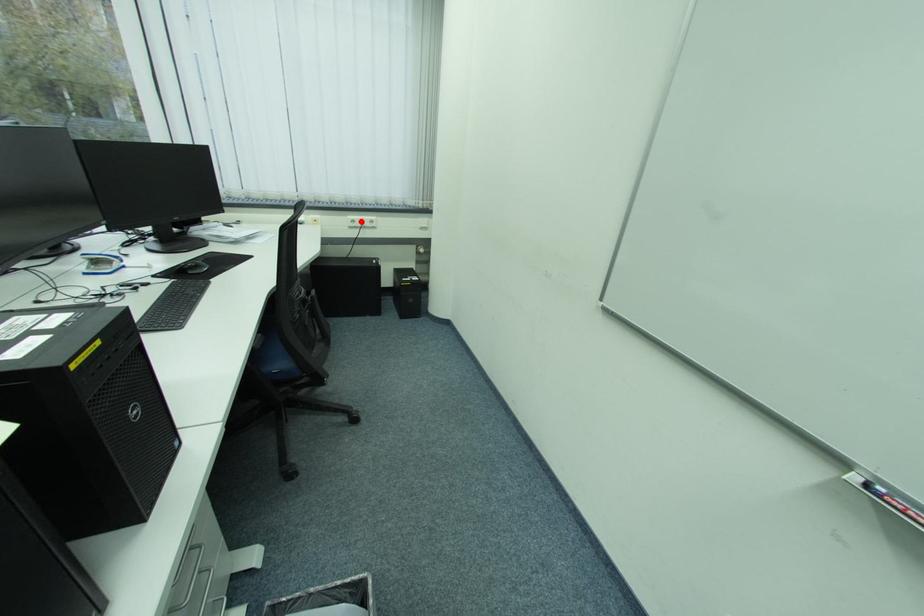
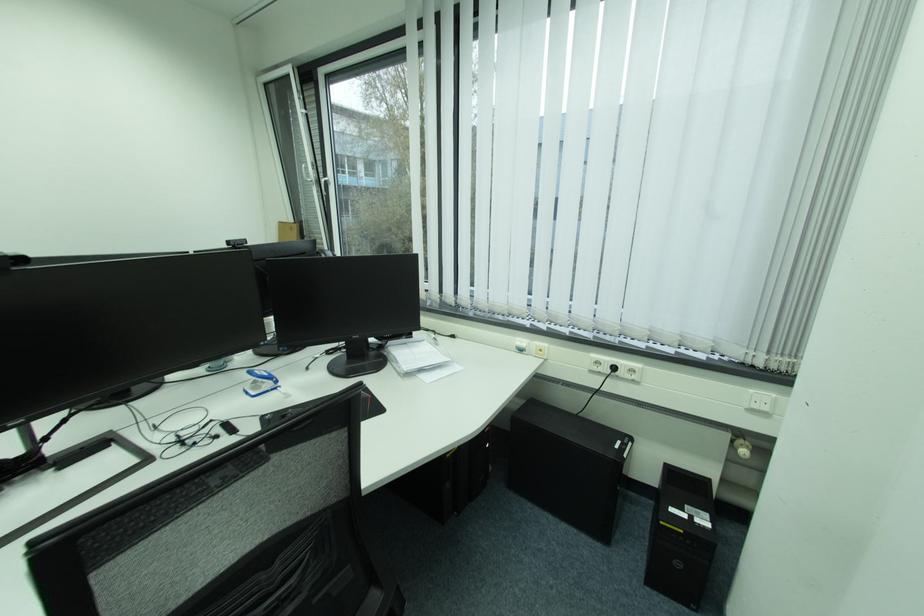
The point at the highlighted location is marked in the first image. Where is the corresponding point in the second image?

(605, 363)